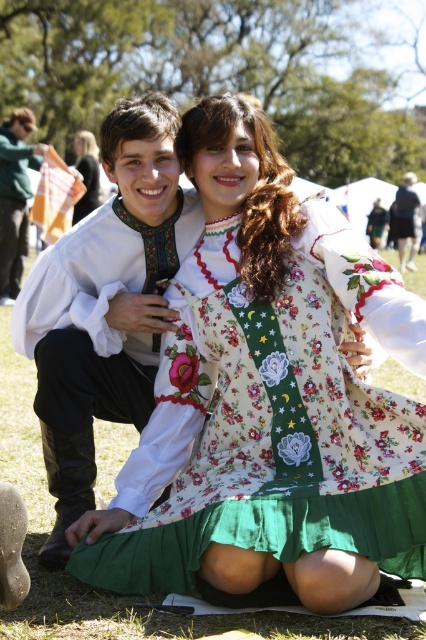
Question: Among these points, which one is nearest to the camera?

Choices:
 (A) click(x=97, y=260)
 (B) click(x=16, y=112)
 (C) click(x=95, y=170)
 (D) click(x=218, y=317)

Answer: (D)

Question: Which of the following is the closest to the observer?

Choices:
 (A) white satin shirt at center
 (B) white floral dress at center

Answer: (A)

Question: In this image, where is floral cotton dress at center located relative to white floral dress at center?

Choices:
 (A) right
 (B) left

Answer: (A)

Question: Which of these objects is positioned farthest from the floral cotton dress at center?

Choices:
 (A) white satin shirt at center
 (B) matte black shirt at left

Answer: (B)

Question: Does white satin shirt at center have a greater width compared to matte black shirt at left?

Choices:
 (A) no
 (B) yes

Answer: (A)

Question: Is floral cotton dress at center positioned behind matte black shirt at left?

Choices:
 (A) yes
 (B) no

Answer: (B)